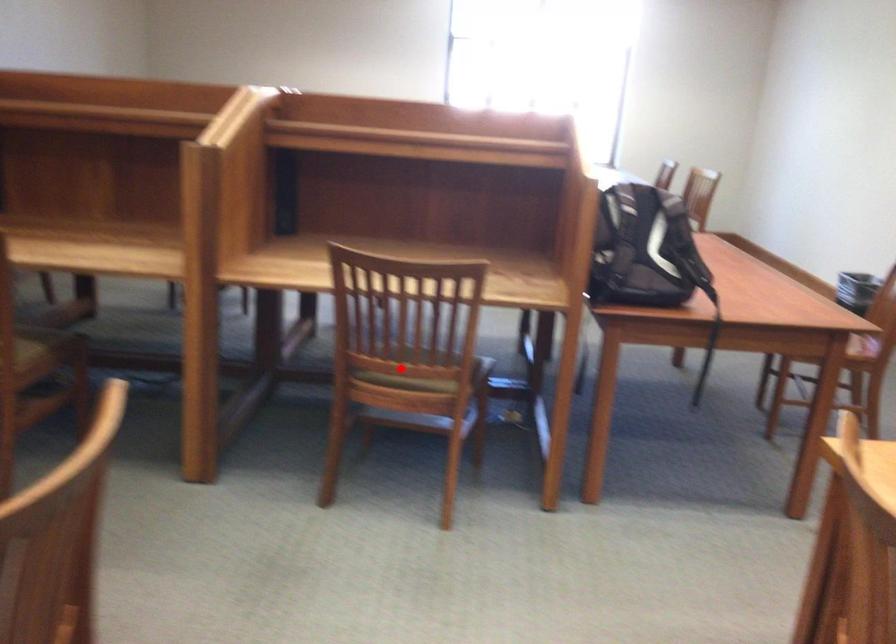
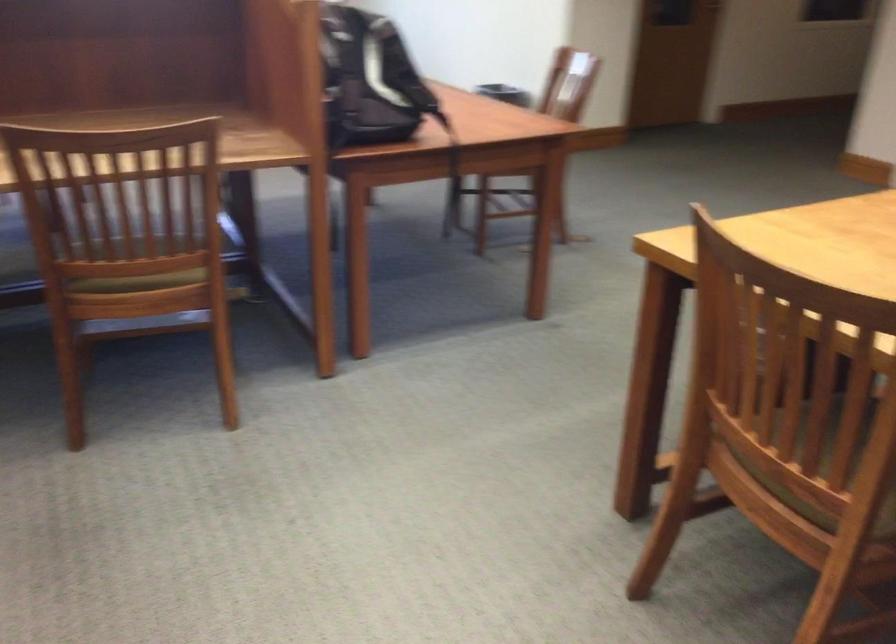
Question: I am providing you with two images of the same scene from different viewpoints. In image1, a red point is highlighted. Considering the same 3D point in image2, which of the following is correct?

Choices:
 (A) It is closer
 (B) It is farther

Answer: (A)